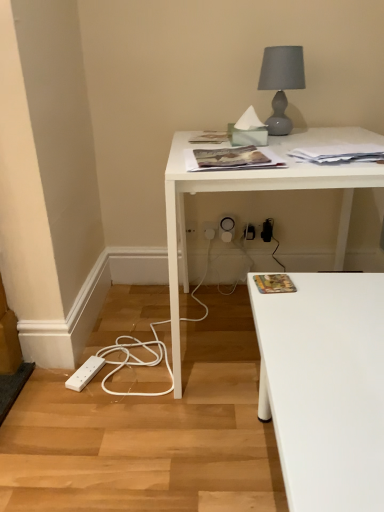
Locate an element on the screen. The height and width of the screenshot is (512, 384). free spot to the right of white plastic extension cord at lower left is located at coordinates 135,374.